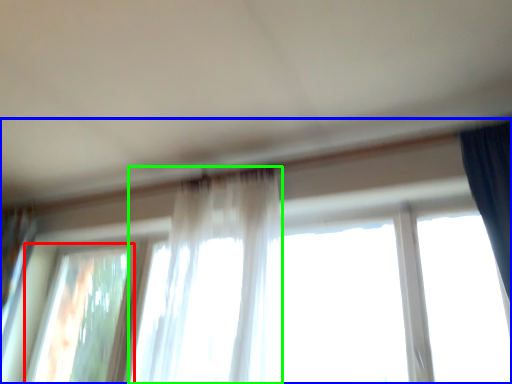
Question: Based on their relative distances, which object is nearer to window (highlighted by a red box)? Choose from window (highlighted by a blue box) and curtain (highlighted by a green box).

Choices:
 (A) window
 (B) curtain

Answer: (A)